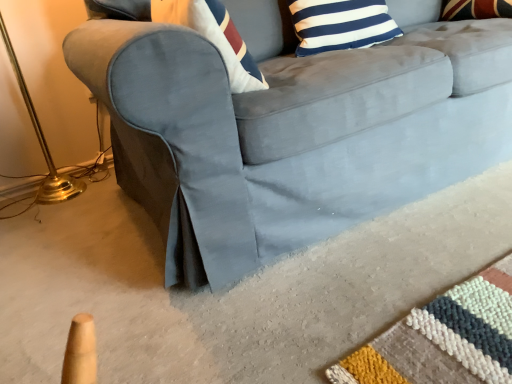
Question: From the image's perspective, is blue and white striped pillow at upper center above or below gold metallic table lamp at left?

Choices:
 (A) below
 (B) above

Answer: (B)

Question: Does point [x=324, y=44] appear closer or farther from the camera than point [x=29, y=102]?

Choices:
 (A) closer
 (B) farther

Answer: (A)

Question: Which object is positioned farthest from the blue and white striped pillow at upper center?

Choices:
 (A) suede gray couch at center
 (B) gold metallic table lamp at left

Answer: (B)

Question: Which is nearer to the blue and white striped pillow at upper center?

Choices:
 (A) suede gray couch at center
 (B) gold metallic table lamp at left

Answer: (A)